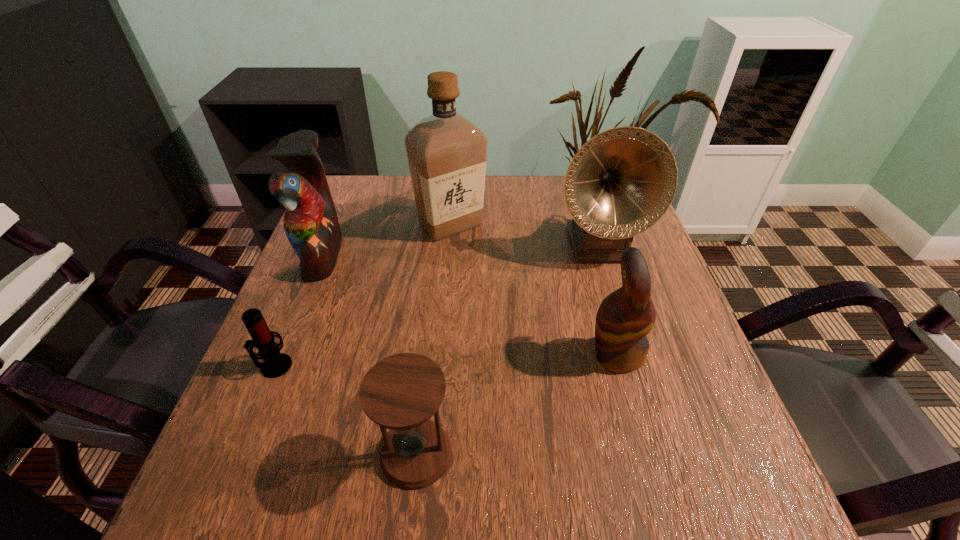
Identify the location of vacant space situated on the face of the nearer parrot. (423, 354).

Where is `vacant area located on the face of the nearer parrot`? vacant area located on the face of the nearer parrot is located at coordinates (516, 354).

Locate an element on the screen. This screenshot has width=960, height=540. free space located 0.270m on the face of the nearer parrot is located at coordinates (448, 354).

Find the location of a particular element. The width and height of the screenshot is (960, 540). vacant space situated 0.120m on the right of the hourglass is located at coordinates (525, 454).

You are a GUI agent. You are given a task and a screenshot of the screen. Output one action in this format:
    pyautogui.click(x=<x>, y=<y>)
    Task: Click on the vacant space situated 0.230m on the right of the shortest object
    This screenshot has width=960, height=540.
    Given the screenshot: What is the action you would take?
    pos(412,366)

Where is `liquor present at the far edge`? This screenshot has height=540, width=960. liquor present at the far edge is located at coordinates (446, 152).

The image size is (960, 540). In order to click on phonograph record present at the far edge in this screenshot , I will do `click(622, 181)`.

Locate an element on the screen. The width and height of the screenshot is (960, 540). object at the near edge is located at coordinates (401, 392).

Image resolution: width=960 pixels, height=540 pixels. Find the location of `parrot present at the left edge`. parrot present at the left edge is located at coordinates (311, 225).

Identify the location of microphone that is at the left edge. This screenshot has width=960, height=540. pos(276,364).